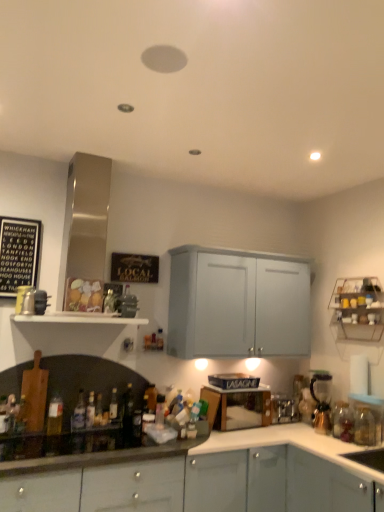
You are a GUI agent. You are given a task and a screenshot of the screen. Output one action in this format:
    pyautogui.click(x=<x>, y=<y>)
    Task: Click on the free space that is to the left of translucent glass bottle at lower right, positioned as the 1th bottle in right-to-left order
    The width and height of the screenshot is (384, 512).
    Given the screenshot: What is the action you would take?
    pyautogui.click(x=319, y=441)